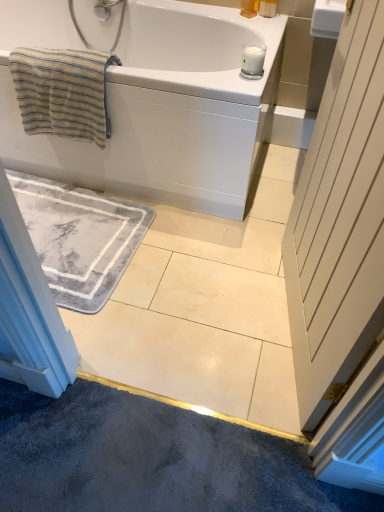
The height and width of the screenshot is (512, 384). In order to click on free region under gray plush bath mat at lower left (from a real-world perspective) in this screenshot , I will do `click(90, 245)`.